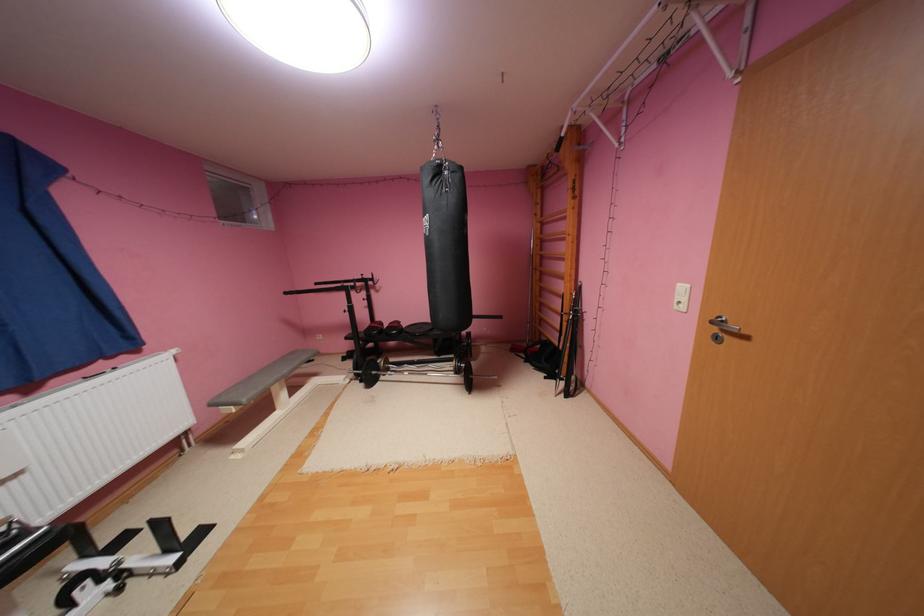
Find where to push the black punching bag. Please return your answer as a coordinate pair (x, y).

(445, 245)